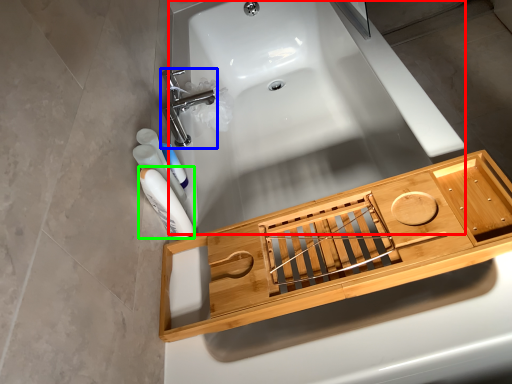
Question: Considering the real-world distances, which object is farthest from bath (highlighted by a red box)? tap (highlighted by a blue box) or mouthwash (highlighted by a green box)?

Choices:
 (A) tap
 (B) mouthwash

Answer: (B)